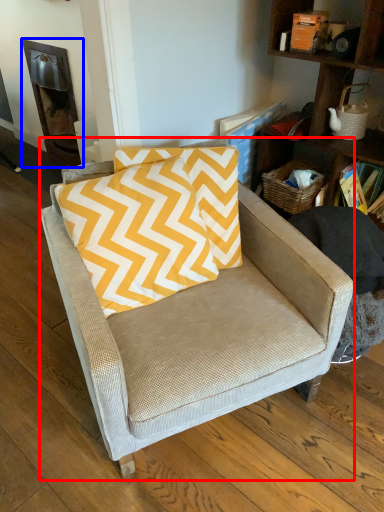
Question: Among these objects, which one is farthest to the camera, chair (highlighted by a red box) or fireplace (highlighted by a blue box)?

Choices:
 (A) chair
 (B) fireplace

Answer: (B)